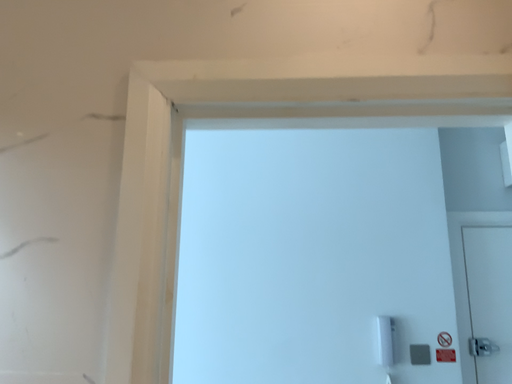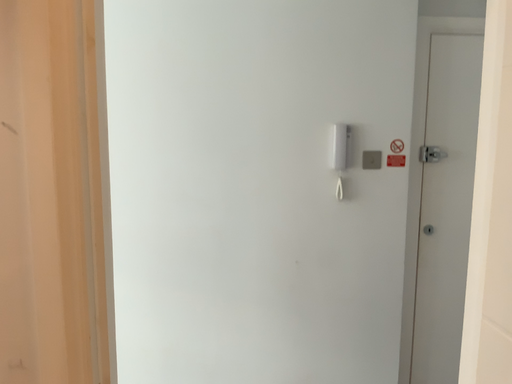
Question: How did the camera likely rotate when shooting the video?

Choices:
 (A) rotated upward
 (B) rotated downward

Answer: (B)